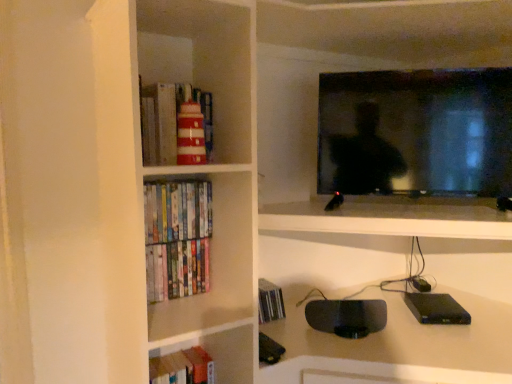
Locate an element on the screen. black glossy tv at upper right is located at coordinates (x=416, y=132).

This screenshot has height=384, width=512. Describe the element at coordinates (177, 269) in the screenshot. I see `hardcover books at left` at that location.

Where is `hardcover books at lower left`? The image size is (512, 384). hardcover books at lower left is located at coordinates (213, 356).

From the image's perspective, is hardcover books at lower left beneath hardcover books at left?

Correct, hardcover books at lower left appears lower than hardcover books at left in the image.

Is hardcover books at lower left inside the boundaries of hardcover books at left, or outside?

hardcover books at lower left is located beyond the bounds of hardcover books at left.

From the picture: Does hardcover books at lower left appear on the right side of hardcover books at left?

Correct, you'll find hardcover books at lower left to the right of hardcover books at left.

Would you say black glossy tv at upper right is a long distance from hardcover books at lower left?

That's not correct — black glossy tv at upper right is a little close to hardcover books at lower left.

Is black glossy tv at upper right turned away from hardcover books at lower left?

No, black glossy tv at upper right is not facing the opposite direction of hardcover books at lower left.

Considering the sizes of objects black glossy tv at upper right and hardcover books at lower left in the image provided, who is smaller, black glossy tv at upper right or hardcover books at lower left?

hardcover books at lower left.

From the image's perspective, which one is positioned lower, black glossy tv at upper right or hardcover books at lower left?

hardcover books at lower left appears lower in the image.

In terms of height, does hardcover books at lower left look taller or shorter compared to black glossy tv at upper right?

In the image, hardcover books at lower left appears to be shorter than black glossy tv at upper right.

Would you say hardcover books at lower left is to the left or to the right of black glossy tv at upper right in the picture?

In the image, hardcover books at lower left appears on the left side of black glossy tv at upper right.

Is hardcover books at lower left spatially inside black glossy tv at upper right, or outside of it?

hardcover books at lower left is not inside black glossy tv at upper right, it's outside.

Considering the sizes of objects hardcover books at left and hardcover books at lower left in the image provided, who is smaller, hardcover books at left or hardcover books at lower left?

hardcover books at left is smaller.

Between point (186, 280) and point (189, 382), which one is positioned in front?

The point (186, 280) is closer.

Is hardcover books at lower left at the back of hardcover books at left?

No, hardcover books at left's orientation is not away from hardcover books at lower left.

How different are the orientations of hardcover books at left and hardcover books at lower left in degrees?

0.00235 degrees.

Does hardcover books at left have a smaller size compared to black glossy tv at upper right?

Correct, hardcover books at left occupies less space than black glossy tv at upper right.

From the picture: From the image's perspective, is hardcover books at left positioned above or below black glossy tv at upper right?

From the image's perspective, hardcover books at left appears below black glossy tv at upper right.

Considering the relative sizes of hardcover books at left and black glossy tv at upper right in the image provided, is hardcover books at left thinner than black glossy tv at upper right?

Correct, the width of hardcover books at left is less than that of black glossy tv at upper right.

Is black glossy tv at upper right situated inside hardcover books at left or outside?

black glossy tv at upper right cannot be found inside hardcover books at left.

From a real-world perspective, which is physically below, black glossy tv at upper right or hardcover books at left?

hardcover books at left is physically lower.

Considering the relative positions of black glossy tv at upper right and hardcover books at left in the image provided, is black glossy tv at upper right in front of hardcover books at left?

Yes, it is in front of hardcover books at left.

Is black glossy tv at upper right wider than hardcover books at left?

Yes.

This screenshot has height=384, width=512. Identify the location of shelf behind the hardcover books at left. (213, 356).

The height and width of the screenshot is (384, 512). Find the location of `television above the hardcover books at lower left (from a real-world perspective)`. television above the hardcover books at lower left (from a real-world perspective) is located at coordinates (416, 132).

Estimate the real-world distances between objects in this image. Which object is closer to black glossy tv at upper right, hardcover books at lower left or hardcover books at left?

hardcover books at left lies closer to black glossy tv at upper right than the other object.

Considering their positions, is hardcover books at left positioned further to black glossy tv at upper right than hardcover books at lower left?

hardcover books at lower left is positioned further to the anchor black glossy tv at upper right.

When comparing their distances from hardcover books at left, does black glossy tv at upper right or hardcover books at lower left seem closer?

Among the two, hardcover books at lower left is located nearer to hardcover books at left.

Estimate the real-world distances between objects in this image. Which object is further from hardcover books at lower left, black glossy tv at upper right or hardcover books at left?

black glossy tv at upper right is positioned further to the anchor hardcover books at lower left.

Based on their spatial positions, is hardcover books at lower left or black glossy tv at upper right further from hardcover books at left?

The object further to hardcover books at left is black glossy tv at upper right.

Consider the image. From the image, which object appears to be nearer to hardcover books at lower left, hardcover books at left or black glossy tv at upper right?

Based on the image, hardcover books at left appears to be nearer to hardcover books at lower left.

Locate an element on the screen. shelf located between hardcover books at left and black glossy tv at upper right in the left-right direction is located at coordinates (213, 356).